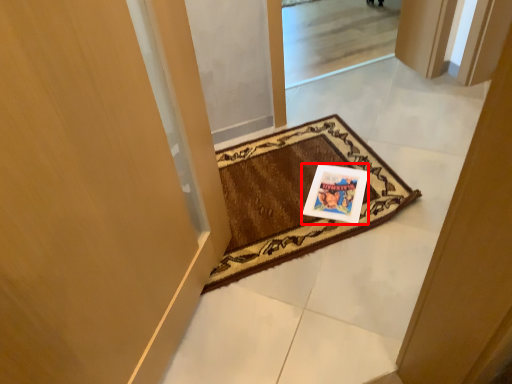
Question: Considering the relative positions of postcard (annotated by the red box) and mat in the image provided, where is postcard (annotated by the red box) located with respect to the staircase?

Choices:
 (A) left
 (B) right

Answer: (B)